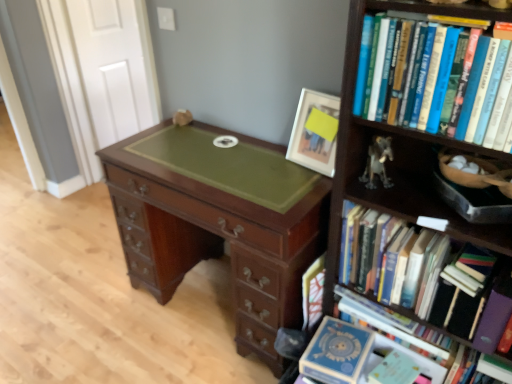
Question: Is mahogany wood desk at center bigger or smaller than wooden bookcase at right?

Choices:
 (A) big
 (B) small

Answer: (A)

Question: Relative to wooden bookcase at right, is mahogany wood desk at center in front or behind?

Choices:
 (A) behind
 (B) front

Answer: (A)

Question: Which object is positioned closest to the mahogany wood desk at center?

Choices:
 (A) matte white picture frame at upper right
 (B) wooden bookcase at right
 (C) hardcover book at center, the 2th book ordered from the bottom
 (D) hardcover books at right, marked as the first book in a bottom-to-top arrangement
 (E) metallic silver figurine at upper right

Answer: (A)

Question: Which is nearer to the hardcover books at right, which is the fourth book in top-to-bottom order?

Choices:
 (A) wooden bookcase at right
 (B) hardcover books at right, which appears as the second book when viewed from the top
 (C) white matte door at upper left
 (D) mahogany wood desk at center
 (E) hardcover book at center, acting as the third book starting from the top

Answer: (B)